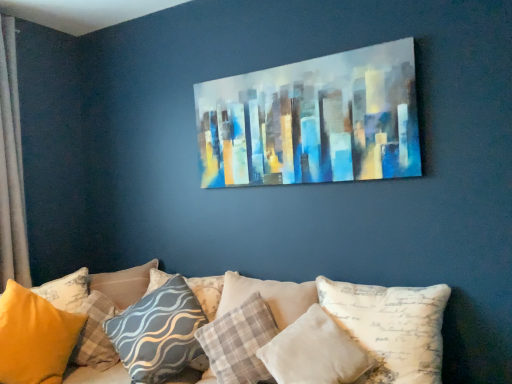
Question: In which direction should I rotate to look at textured gray pillow at center, marked as the 5th pillow in a right-to-left arrangement?

Choices:
 (A) left
 (B) right

Answer: (A)

Question: Is yellow fabric pillow at lower left, placed as the sixth pillow when sorted from right to left, oriented towards gray wavy-patterned pillow at center, the 4th pillow from the right?

Choices:
 (A) yes
 (B) no

Answer: (B)

Question: Can you confirm if yellow fabric pillow at lower left, placed as the sixth pillow when sorted from right to left, is bigger than gray wavy-patterned pillow at center, the 4th pillow from the right?

Choices:
 (A) no
 (B) yes

Answer: (A)

Question: Is yellow fabric pillow at lower left, placed as the sixth pillow when sorted from right to left, next to gray wavy-patterned pillow at center, the 4th pillow when ordered from left to right, and touching it?

Choices:
 (A) no
 (B) yes

Answer: (A)

Question: Is gray wavy-patterned pillow at center, the 4th pillow when ordered from left to right, at the back of yellow fabric pillow at lower left, placed as the sixth pillow when sorted from right to left?

Choices:
 (A) no
 (B) yes

Answer: (A)

Question: From a real-world perspective, is yellow fabric pillow at lower left, which ranks as the second pillow in left-to-right order, located higher than gray wavy-patterned pillow at center, the 4th pillow from the right?

Choices:
 (A) no
 (B) yes

Answer: (A)

Question: From a real-world perspective, is yellow fabric pillow at lower left, placed as the sixth pillow when sorted from right to left, beneath gray wavy-patterned pillow at center, the 4th pillow from the right?

Choices:
 (A) no
 (B) yes

Answer: (B)

Question: From a real-world perspective, does white fabric pillow at center, the seventh pillow viewed from the left, sit lower than plaid fabric pillow at center, acting as the third pillow starting from the right?

Choices:
 (A) no
 (B) yes

Answer: (A)

Question: Does white fabric pillow at center, the seventh pillow viewed from the left, have a greater width compared to plaid fabric pillow at center, acting as the third pillow starting from the right?

Choices:
 (A) yes
 (B) no

Answer: (B)

Question: Does white fabric pillow at center, the seventh pillow viewed from the left, contain plaid fabric pillow at center, acting as the 5th pillow starting from the left?

Choices:
 (A) no
 (B) yes

Answer: (A)

Question: From a real-world perspective, is white fabric pillow at center, which is the first pillow from right to left, positioned over plaid fabric pillow at center, acting as the 5th pillow starting from the left, based on gravity?

Choices:
 (A) yes
 (B) no

Answer: (A)

Question: Is white fabric pillow at center, the seventh pillow viewed from the left, not near plaid fabric pillow at center, acting as the 5th pillow starting from the left?

Choices:
 (A) no
 (B) yes

Answer: (A)

Question: Does white fabric pillow at center, the seventh pillow viewed from the left, come behind plaid fabric pillow at center, acting as the third pillow starting from the right?

Choices:
 (A) yes
 (B) no

Answer: (B)

Question: From the image's perspective, is silky beige curtain at left below gray wavy-patterned pillow at center, the 4th pillow from the right?

Choices:
 (A) yes
 (B) no

Answer: (B)